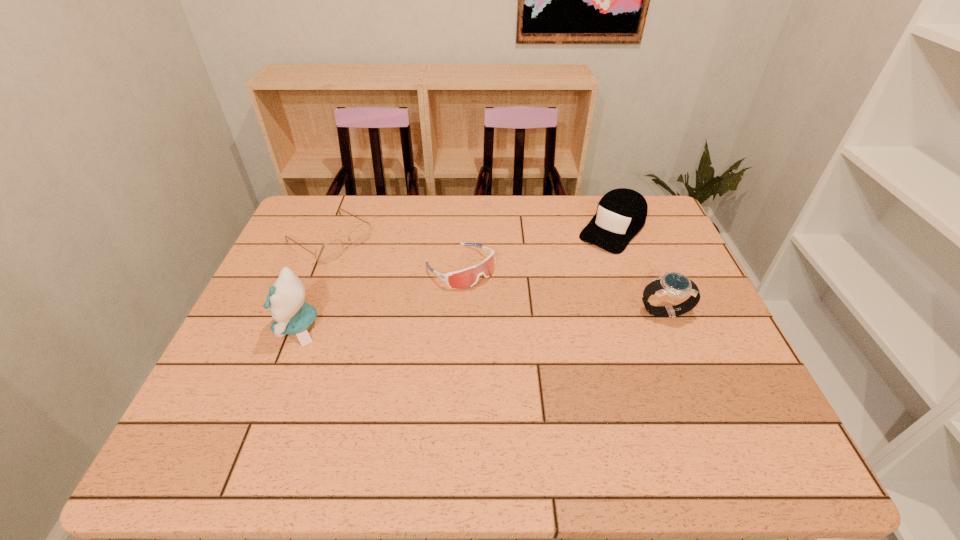
At what (x,y) coordinates should I click in order to perform the action: click on the tallest object. Please return your answer as a coordinate pair (x, y). This screenshot has height=540, width=960. Looking at the image, I should click on (286, 300).

Where is `watch`? watch is located at coordinates (676, 285).

Where is `cap`? cap is located at coordinates (621, 213).

Locate an element on the screen. This screenshot has width=960, height=540. goggles is located at coordinates (465, 278).

This screenshot has width=960, height=540. I want to click on the third object from right to left, so click(465, 278).

Where is `the shortest object`? This screenshot has height=540, width=960. the shortest object is located at coordinates (327, 252).

Image resolution: width=960 pixels, height=540 pixels. I want to click on free space located on the left of the watch, so click(x=503, y=311).

The width and height of the screenshot is (960, 540). I want to click on free space located on the front-facing side of the cap, so click(x=528, y=325).

At what (x,y) coordinates should I click in order to perform the action: click on free space located 0.080m on the front-facing side of the cap. Please return your answer as a coordinate pair (x, y). This screenshot has width=960, height=540. Looking at the image, I should click on (585, 263).

Find the location of a particular element. vacant space situated on the front-facing side of the cap is located at coordinates (581, 267).